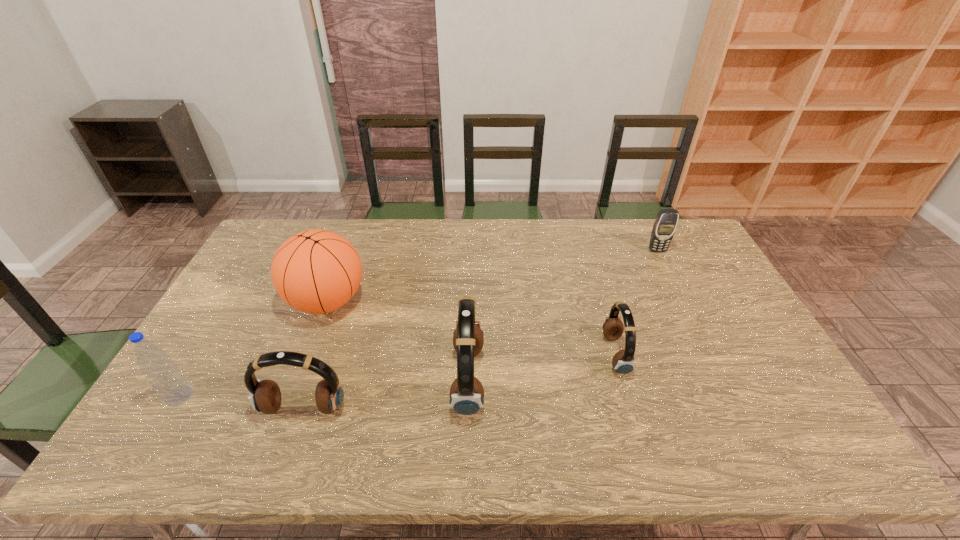
Locate an element on the screen. This screenshot has height=540, width=960. free spot between the second shortest headset and the water bottle is located at coordinates (241, 402).

Find the location of `empty location between the second shortest headset and the basketball`. empty location between the second shortest headset and the basketball is located at coordinates (316, 355).

Where is `vacant point located between the tallest headset and the leftmost headset`? Image resolution: width=960 pixels, height=540 pixels. vacant point located between the tallest headset and the leftmost headset is located at coordinates (386, 395).

Identify the location of vacant space that's between the fifth object from left to right and the rightmost object. (636, 302).

What are the coordinates of `the fifth closest object to the leftmost object` in the screenshot? It's located at (664, 227).

I want to click on object that stands as the closest to the leftmost headset, so click(164, 376).

Choose which headset is the third nearest neighbor to the leftmost object. Please provide its 2D coordinates. Your answer should be formatted as a tuple, i.e. [(x, y)], where the tuple contains the x and y coordinates of a point satisfying the conditions above.

[(623, 362)]

The width and height of the screenshot is (960, 540). What are the coordinates of `headset that is the closest to the second tallest headset` in the screenshot? It's located at (466, 394).

Find the location of a particular element. This screenshot has height=540, width=960. free location that satisfies the following two spatial constraints: 1. on the front face of the farthest object; 2. on the ear cup of the rightmost headset is located at coordinates click(708, 354).